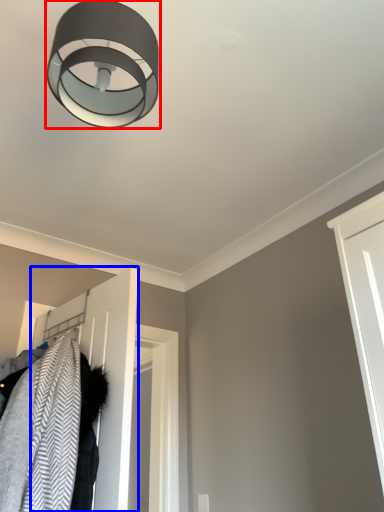
Question: Which of the following is the farthest to the observer, lamp (highlighted by a red box) or door (highlighted by a blue box)?

Choices:
 (A) lamp
 (B) door

Answer: (B)